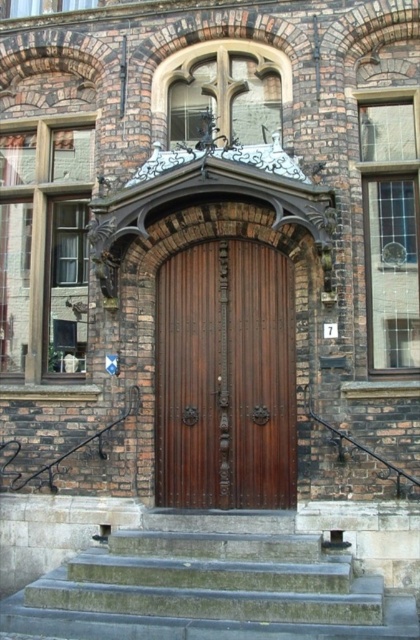
Can you confirm if gray stone stairs at center is wider than polished wood door at center?

Correct, the width of gray stone stairs at center exceeds that of polished wood door at center.

What do you see at coordinates (210, 586) in the screenshot? I see `gray stone stairs at center` at bounding box center [210, 586].

Does point (165, 588) lie behind point (244, 432)?

No, (165, 588) is closer to viewer.

The image size is (420, 640). I want to click on gray stone stairs at center, so click(x=210, y=586).